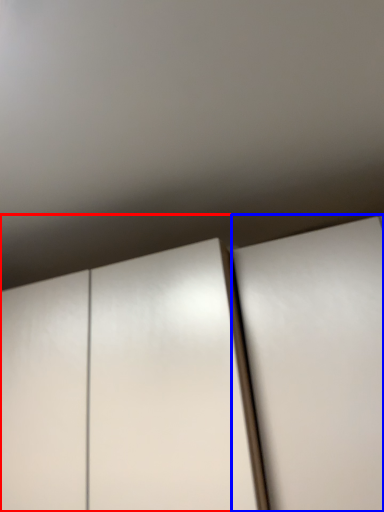
Question: Which of the following is the farthest to the observer, cupboard (highlighted by a red box) or door (highlighted by a blue box)?

Choices:
 (A) cupboard
 (B) door

Answer: (A)